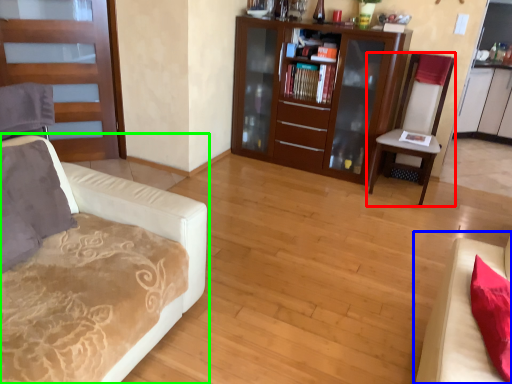
Question: Which object is the closest to the chair (highlighted by a red box)? Choose among these: studio couch (highlighted by a blue box) or studio couch (highlighted by a green box).

Choices:
 (A) studio couch
 (B) studio couch

Answer: (A)